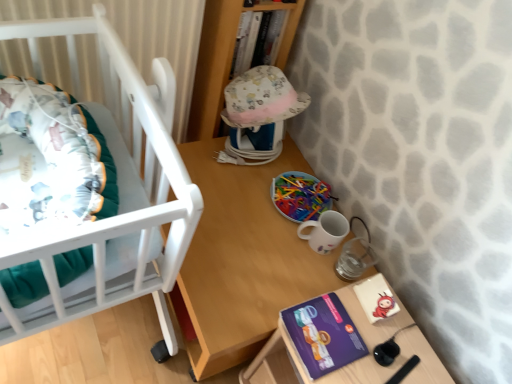
The width and height of the screenshot is (512, 384). What are the coordinates of `free space above wooden table at center (from a real-world perspective)` in the screenshot? It's located at (260, 217).